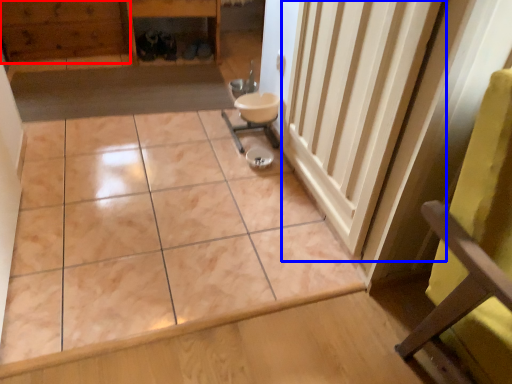
Question: Which point is closer to the camera, hardwood (highlighted by a red box) or radiator (highlighted by a blue box)?

Choices:
 (A) hardwood
 (B) radiator

Answer: (B)